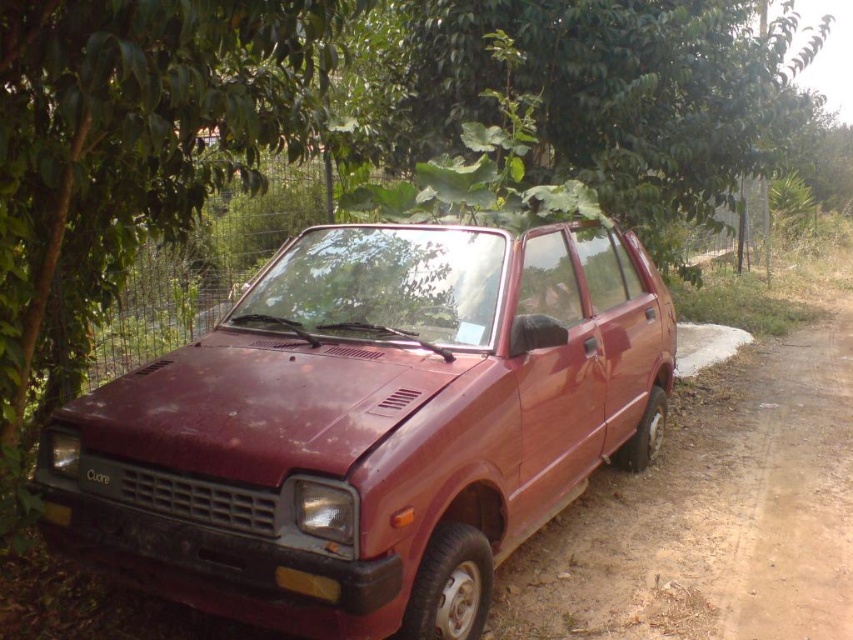
Based on the photo, how distant is brown dirt track at lower right from yellow matte license plate at front?

brown dirt track at lower right is 3.80 meters away from yellow matte license plate at front.

Measure the distance between point (761, 632) and camera.

Point (761, 632) is 11.91 feet away from camera.

This screenshot has width=853, height=640. I want to click on brown dirt track at lower right, so click(x=712, y=513).

Can you confirm if dull red car at center is wider than brown dirt track at lower right?

Correct, the width of dull red car at center exceeds that of brown dirt track at lower right.

Is point (450, 470) farther from camera compared to point (682, 403)?

No.

Find the location of a particular element. dull red car at center is located at coordinates (370, 426).

Is green leafy tree at upper center shorter than yellow matte license plate at front?

Incorrect, green leafy tree at upper center's height does not fall short of yellow matte license plate at front's.

Is green leafy tree at upper center below yellow matte license plate at front?

No, green leafy tree at upper center is not below yellow matte license plate at front.

Does point (733, 157) come behind point (57, 524)?

Yes, it is behind point (57, 524).

You are a GUI agent. You are given a task and a screenshot of the screen. Output one action in this format:
    pyautogui.click(x=<x>, y=<y>)
    Task: Click on the green leafy tree at upper center
    The width and height of the screenshot is (853, 640).
    Given the screenshot: What is the action you would take?
    pyautogui.click(x=605, y=90)